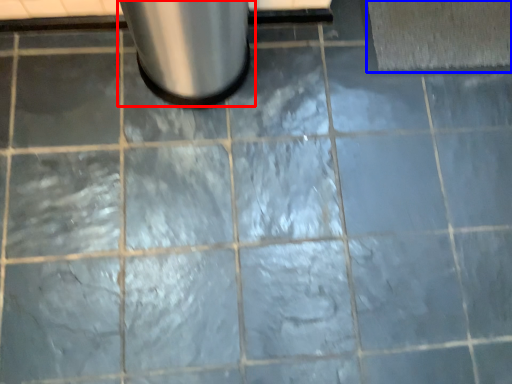
Question: Among these objects, which one is nearest to the camera, waste container (highlighted by a red box) or bath mat (highlighted by a blue box)?

Choices:
 (A) waste container
 (B) bath mat

Answer: (A)